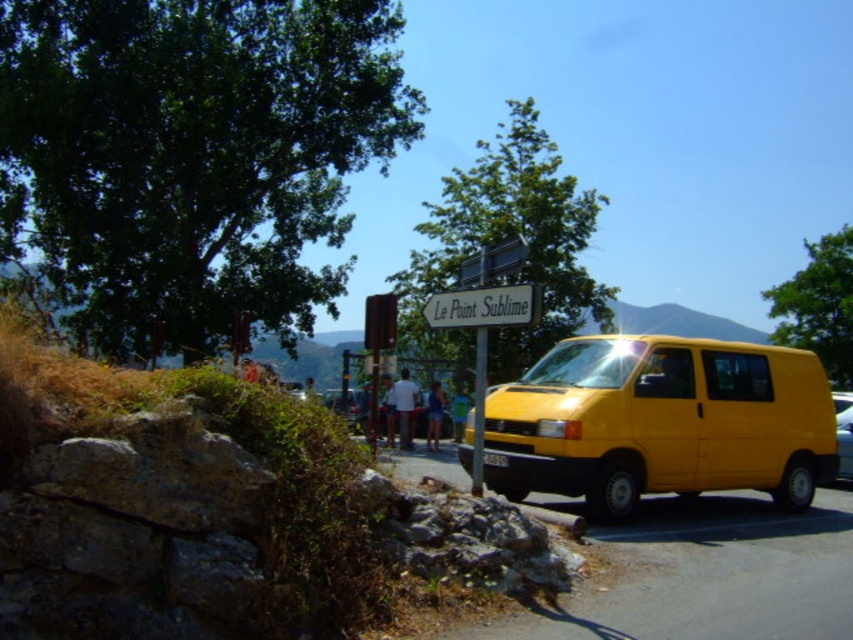
You are a pedestrian standing on the road near the bright yellow van. You see both the white plastic sign at center and the white fabric shirt at center. Which object is nearer to you?

The white plastic sign at center is closer to the viewer than the white fabric shirt at center.

You are a photographer trying to capture a candid shot of the blue denim shorts at center and the white fabric shirt at center. Since you want to ensure both are visible in the frame, which object should you focus on first considering their heights?

The blue denim shorts at center has a lesser height compared to white fabric shirt at center, so you should focus on the white fabric shirt at center first to ensure both are in the frame.